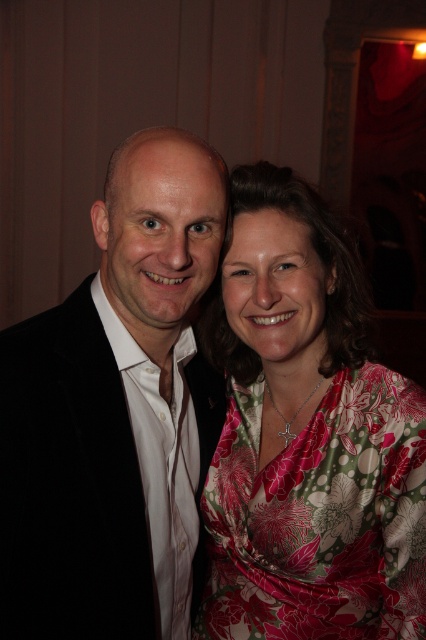
You are a photographer adjusting the focus on your camera. You need to ensure both the black velvet suit at left and the floral silk dress at center are in focus. Which object should you focus on first to achieve proper depth of field?

You should focus on the black velvet suit at left first because it is closer to the viewer than the floral silk dress at center, allowing the depth of field to extend backward to include both subjects.

You are a photographer adjusting the camera focus. The black velvet suit at left is represented by point (x=115, y=412). Where should you focus the camera to ensure the black velvet suit at left is in sharp focus?

The camera should focus on point (x=115, y=412) to ensure the black velvet suit at left is in sharp focus.

In the scene shown: You are a photographer trying to adjust the lighting for a group photo. You notice the black velvet suit at left and the floral silk dress at center. Which clothing item requires more space in the frame to avoid being cut off?

The black velvet suit at left requires more space in the frame because it is bigger than the floral silk dress at center.